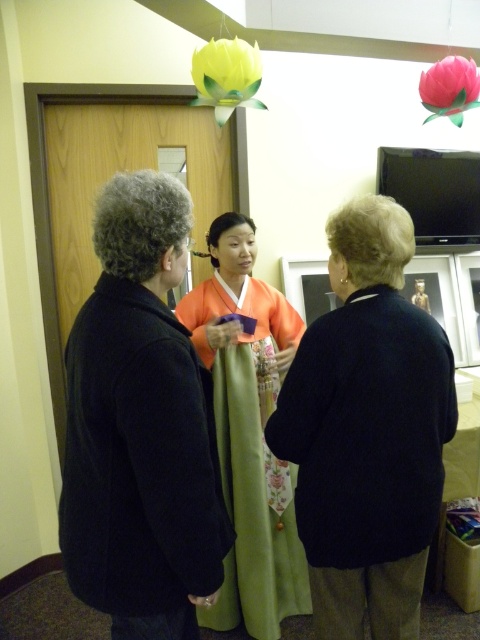
Does orange satin kimono at center have a lesser width compared to yellow paper flower at upper center?

No.

Which is above, orange satin kimono at center or yellow paper flower at upper center?

yellow paper flower at upper center is above.

Locate an element on the screen. This screenshot has width=480, height=640. orange satin kimono at center is located at coordinates (249, 429).

Locate an element on the screen. This screenshot has height=640, width=480. orange satin kimono at center is located at coordinates (249, 429).

Can you confirm if yellow paper flower at upper center is thinner than pink fabric flower at upper center?

In fact, yellow paper flower at upper center might be wider than pink fabric flower at upper center.

Does yellow paper flower at upper center have a larger size compared to pink fabric flower at upper center?

Indeed, yellow paper flower at upper center has a larger size compared to pink fabric flower at upper center.

Locate an element on the screen. The height and width of the screenshot is (640, 480). yellow paper flower at upper center is located at coordinates (227, 76).

Which is more to the left, green silk robe at center or orange satin kimono at center?

green silk robe at center is more to the left.

Does green silk robe at center appear on the left side of orange satin kimono at center?

Correct, you'll find green silk robe at center to the left of orange satin kimono at center.

Does point (88, 301) come farther from viewer compared to point (181, 314)?

No, (88, 301) is in front of (181, 314).

Find the location of `green silk robe at center`. green silk robe at center is located at coordinates (139, 460).